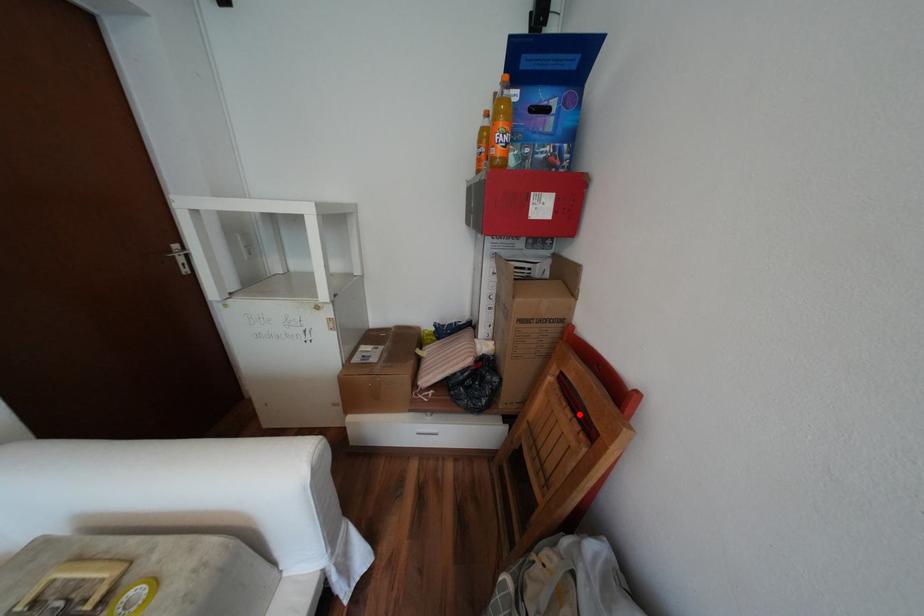
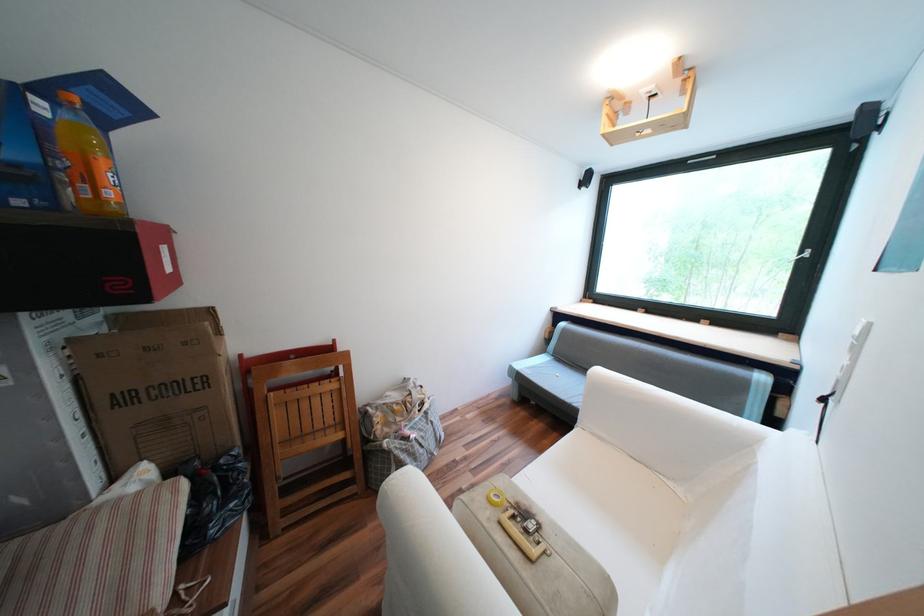
The point at the highlighted location is marked in the first image. Where is the corresponding point in the second image?

(325, 383)